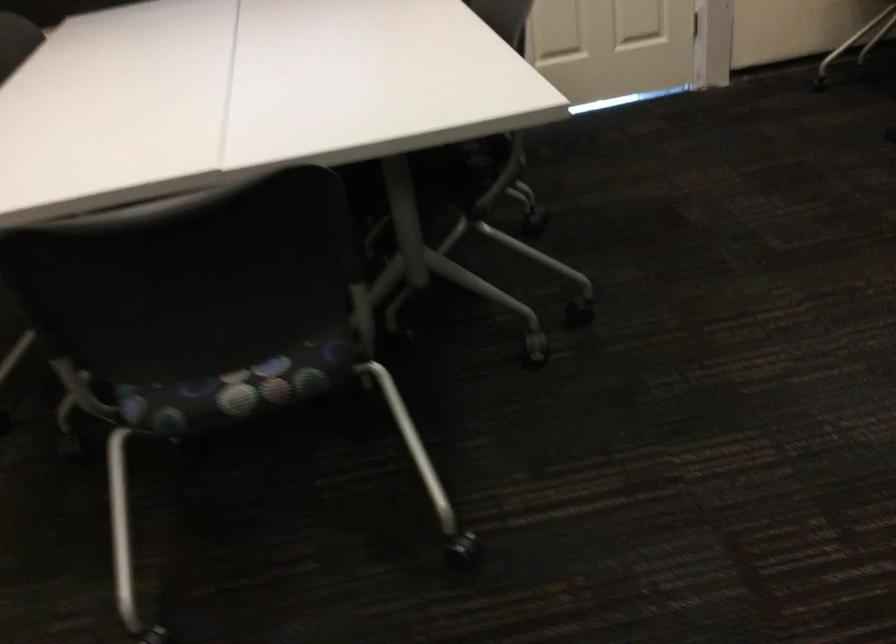
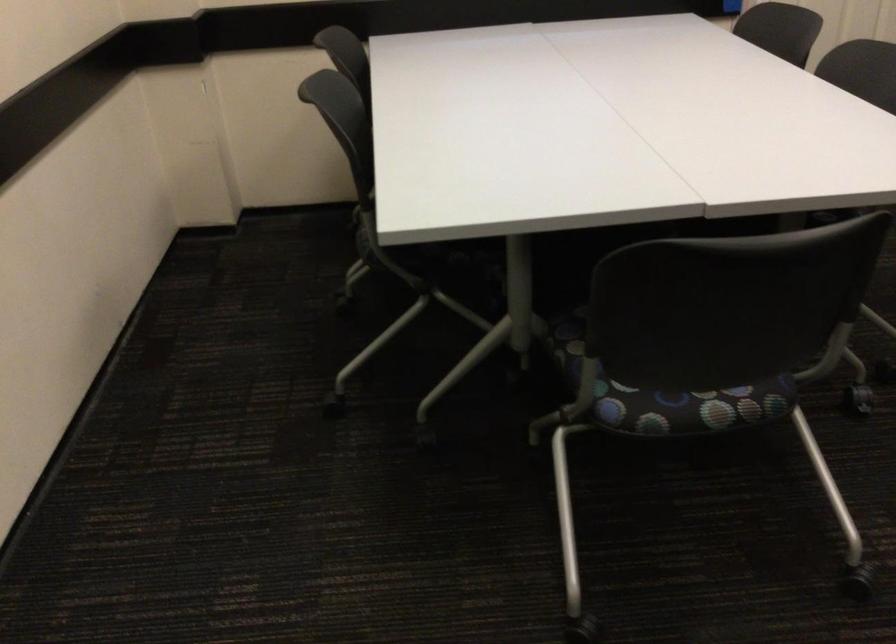
Find the pixel in the second image that matches point 220,393 in the first image.

(688, 406)